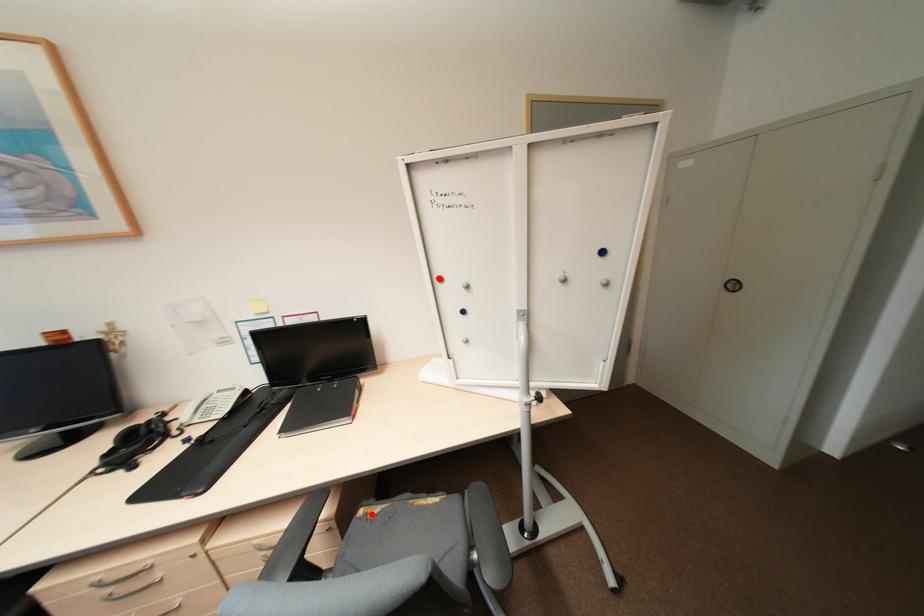
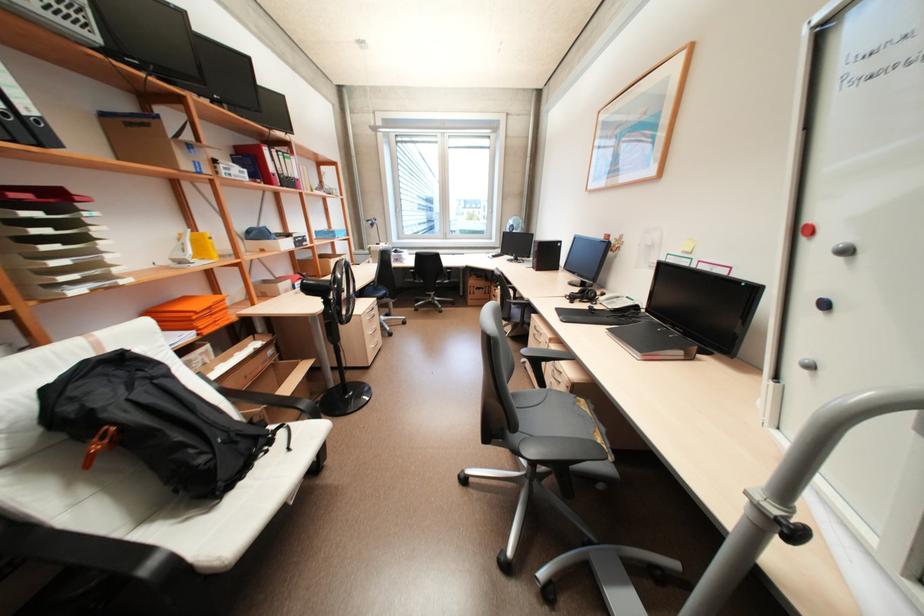
In the second image, find the point that corresponds to the highlighted location in the first image.

(585, 400)